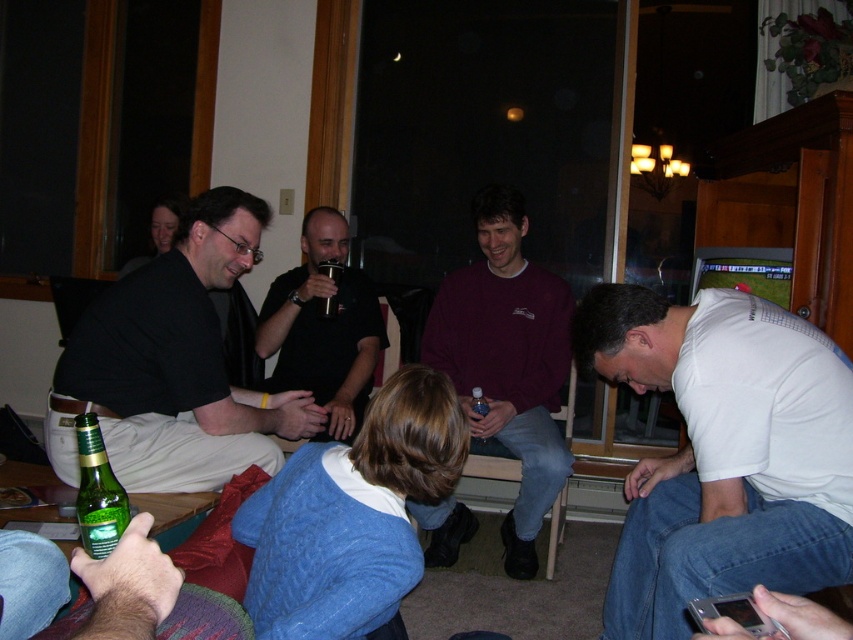
Question: Which object appears closest to the camera in this image?

Choices:
 (A) white matte shirt at lower right
 (B) maroon sweater at center

Answer: (A)

Question: Which of these objects is positioned farthest from the black matte t-shirt at center?

Choices:
 (A) green matte bottle at left
 (B) maroon sweater at center
 (C) clear plastic water bottle at center

Answer: (A)

Question: Does maroon sweater at center appear under green glass bottle at lower left?

Choices:
 (A) yes
 (B) no

Answer: (A)

Question: Can you confirm if green matte bottle at left is positioned above metallic silver cup at center?

Choices:
 (A) no
 (B) yes

Answer: (A)

Question: Which point appears farthest from the camera in this image?

Choices:
 (A) (335, 310)
 (B) (480, 394)

Answer: (A)

Question: Does white matte shirt at lower right appear under green matte bottle at left?

Choices:
 (A) yes
 (B) no

Answer: (A)